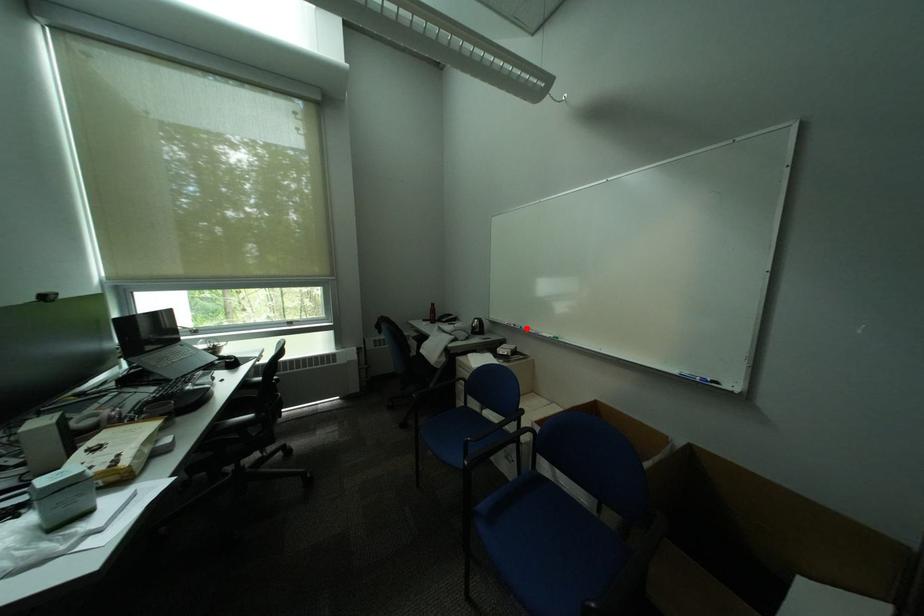
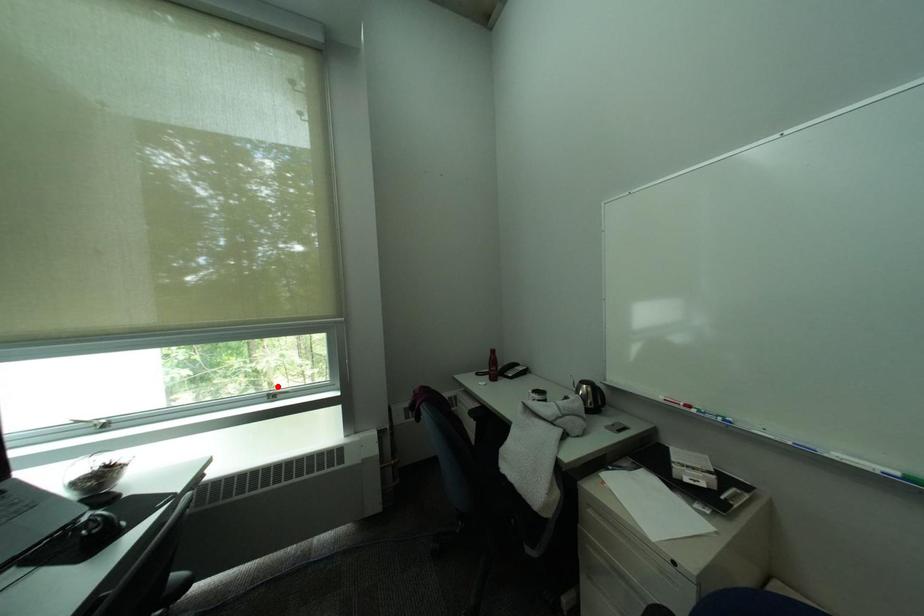
From the picture: I am providing you with two images of the same scene from different viewpoints. A red point is marked on the first image and another point is marked on the second image. Are the points marked in image1 and image2 representing the same 3D position?

No